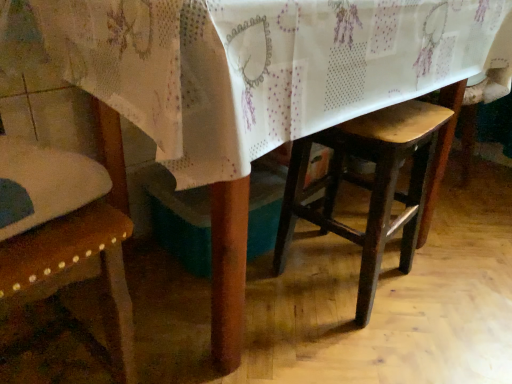
You are a GUI agent. You are given a task and a screenshot of the screen. Output one action in this format:
    pyautogui.click(x=<x>, y=<y>)
    Task: Click on the unoccupied region to the right of wooden chair at left
    
    Given the screenshot: What is the action you would take?
    pyautogui.click(x=208, y=332)